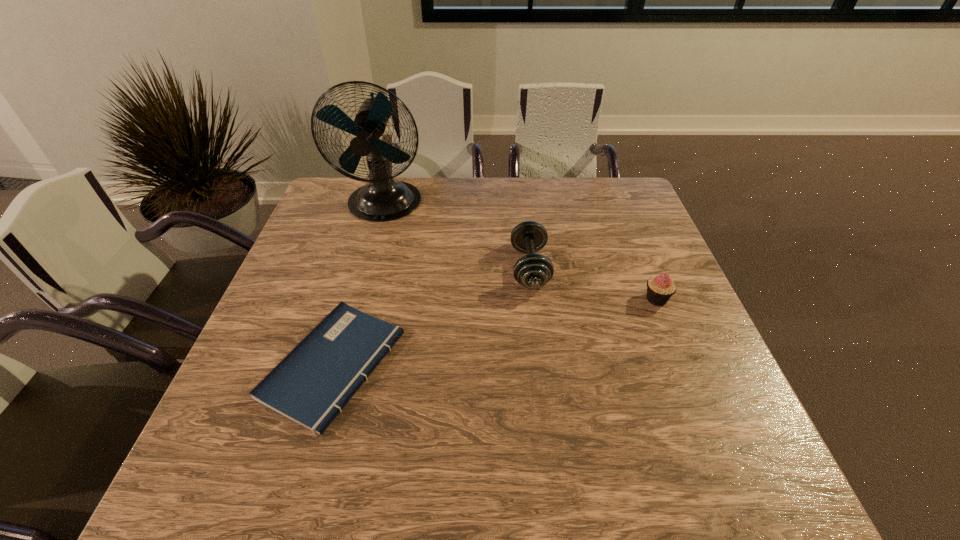
Locate an element on the screen. The width and height of the screenshot is (960, 540). free area in between the second object from right to left and the paperback book is located at coordinates (432, 316).

The width and height of the screenshot is (960, 540). In order to click on object that can be found as the second closest to the cupcake in this screenshot , I will do `click(312, 384)`.

Select which object appears as the second closest to the paperback book. Please provide its 2D coordinates. Your answer should be formatted as a tuple, i.e. [(x, y)], where the tuple contains the x and y coordinates of a point satisfying the conditions above.

[(383, 199)]

Locate an element on the screen. free space that satisfies the following two spatial constraints: 1. on the front-facing side of the fan; 2. on the left side of the third object from left to right is located at coordinates (366, 268).

This screenshot has width=960, height=540. I want to click on vacant region that satisfies the following two spatial constraints: 1. on the back side of the shortest object; 2. on the right side of the dumbbell, so pyautogui.click(x=362, y=268).

What are the coordinates of `vacant space that satisfies the following two spatial constraints: 1. on the front-facing side of the rightmost object; 2. on the right side of the tallest object` in the screenshot? It's located at (357, 299).

This screenshot has height=540, width=960. Identify the location of vacant position in the image that satisfies the following two spatial constraints: 1. on the front-facing side of the farthest object; 2. on the right side of the third object from left to right. (366, 268).

Image resolution: width=960 pixels, height=540 pixels. I want to click on vacant space that satisfies the following two spatial constraints: 1. on the front-facing side of the rightmost object; 2. on the right side of the fan, so click(357, 299).